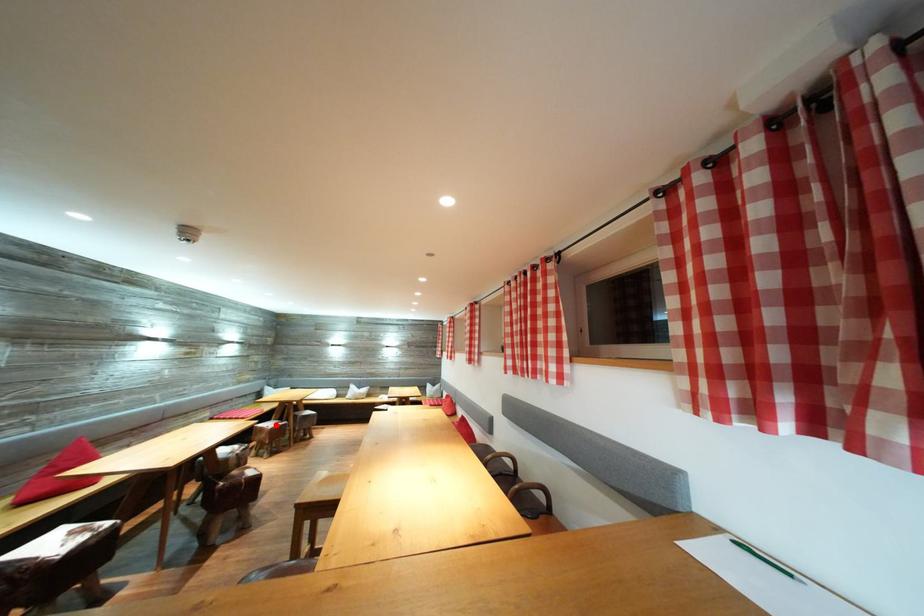
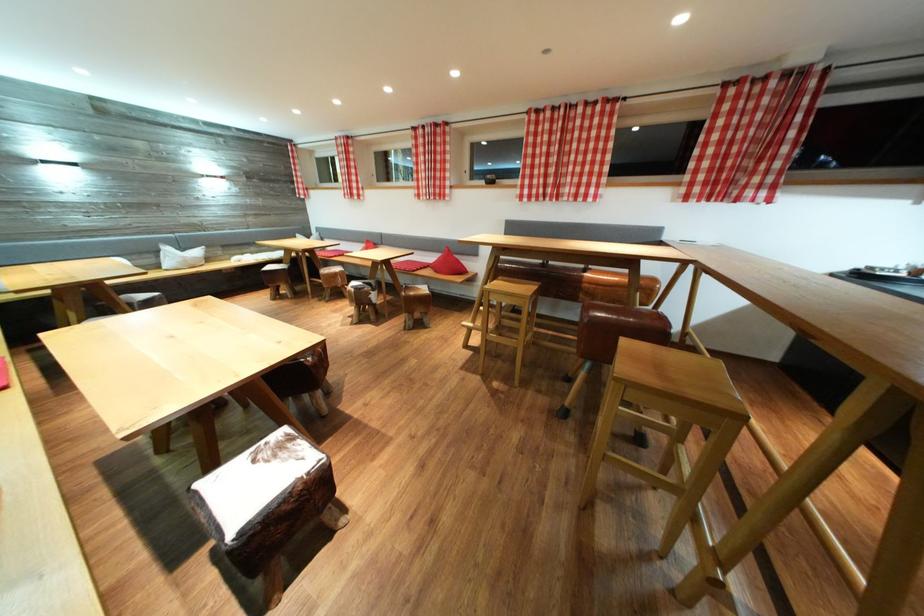
Question: I am providing you with two images of the same scene from different viewpoints. A red point is marked on the first image. Is the red point's position out of view in image 2?

Choices:
 (A) Yes
 (B) No

Answer: (A)